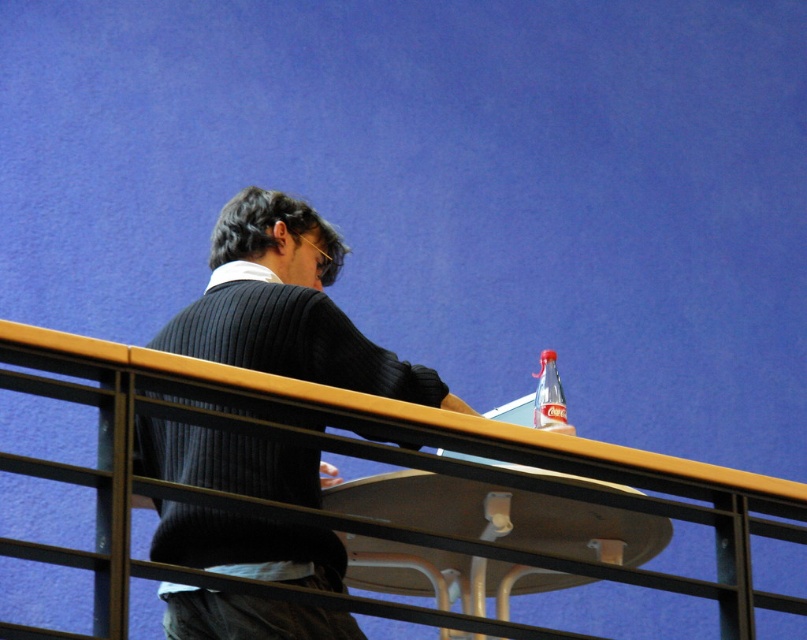
Who is higher up, yellow wood rail at upper center or ribbed sweater at center?

ribbed sweater at center

Can you confirm if yellow wood rail at upper center is wider than ribbed sweater at center?

Yes, yellow wood rail at upper center is wider than ribbed sweater at center.

Describe the element at coordinates (387, 461) in the screenshot. Image resolution: width=807 pixels, height=640 pixels. I see `yellow wood rail at upper center` at that location.

Where is `yellow wood rail at upper center`? Image resolution: width=807 pixels, height=640 pixels. yellow wood rail at upper center is located at coordinates (387, 461).

How much distance is there between ribbed sweater at center and translucent plastic bottle at upper right?

ribbed sweater at center is 3.81 feet from translucent plastic bottle at upper right.

Is ribbed sweater at center positioned behind translucent plastic bottle at upper right?

No, ribbed sweater at center is in front of translucent plastic bottle at upper right.

Describe the element at coordinates (287, 307) in the screenshot. The image size is (807, 640). I see `ribbed sweater at center` at that location.

Locate an element on the screen. This screenshot has width=807, height=640. ribbed sweater at center is located at coordinates (287, 307).

Does yellow wood rail at upper center come behind translucent plastic bottle at upper right?

No, yellow wood rail at upper center is closer to the viewer.

What are the coordinates of `yellow wood rail at upper center` in the screenshot? It's located at (387, 461).

Locate an element on the screen. Image resolution: width=807 pixels, height=640 pixels. yellow wood rail at upper center is located at coordinates (387, 461).